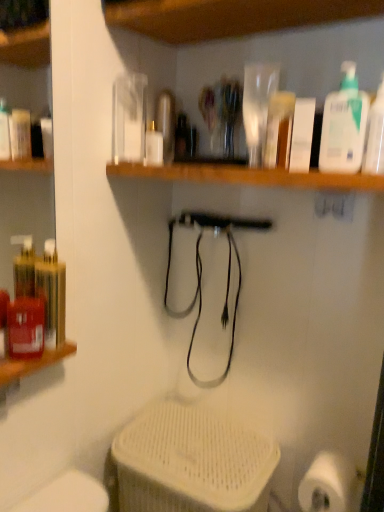
Question: Does translucent plastic bottle at upper right, the first cleaning product from the right, come behind white matte bottle at center?

Choices:
 (A) yes
 (B) no

Answer: (B)

Question: Can you confirm if translucent plastic bottle at upper right, marked as the 2th cleaning product in a left-to-right arrangement, is taller than white matte bottle at center?

Choices:
 (A) no
 (B) yes

Answer: (B)

Question: Considering the relative sizes of translucent plastic bottle at upper right, marked as the 2th cleaning product in a left-to-right arrangement, and white matte bottle at center in the image provided, is translucent plastic bottle at upper right, marked as the 2th cleaning product in a left-to-right arrangement, smaller than white matte bottle at center?

Choices:
 (A) no
 (B) yes

Answer: (B)

Question: Are translucent plastic bottle at upper right, marked as the 2th cleaning product in a left-to-right arrangement, and white matte bottle at center far apart?

Choices:
 (A) yes
 (B) no

Answer: (B)

Question: From the image's perspective, is translucent plastic bottle at upper right, marked as the 2th cleaning product in a left-to-right arrangement, over white matte bottle at center?

Choices:
 (A) yes
 (B) no

Answer: (B)

Question: Is white plastic pump bottle at upper right, arranged as the first cleaning product when viewed from the left, inside or outside of white matte bottle at center?

Choices:
 (A) inside
 (B) outside

Answer: (B)

Question: Is white plastic pump bottle at upper right, arranged as the first cleaning product when viewed from the left, in front of or behind white matte bottle at center in the image?

Choices:
 (A) front
 (B) behind

Answer: (A)

Question: Considering the positions of white plastic pump bottle at upper right, arranged as the first cleaning product when viewed from the left, and white matte bottle at center in the image, is white plastic pump bottle at upper right, arranged as the first cleaning product when viewed from the left, taller or shorter than white matte bottle at center?

Choices:
 (A) tall
 (B) short

Answer: (A)

Question: From a real-world perspective, is white plastic pump bottle at upper right, arranged as the first cleaning product when viewed from the left, positioned above or below white matte bottle at center?

Choices:
 (A) below
 (B) above

Answer: (B)

Question: From the image's perspective, is white plastic pump bottle at upper right, positioned as the 2th cleaning product in right-to-left order, above or below translucent plastic bottle at upper right, marked as the 2th cleaning product in a left-to-right arrangement?

Choices:
 (A) above
 (B) below

Answer: (A)

Question: Considering the positions of white plastic pump bottle at upper right, positioned as the 2th cleaning product in right-to-left order, and translucent plastic bottle at upper right, the first cleaning product from the right, in the image, is white plastic pump bottle at upper right, positioned as the 2th cleaning product in right-to-left order, bigger or smaller than translucent plastic bottle at upper right, the first cleaning product from the right,?

Choices:
 (A) small
 (B) big

Answer: (B)

Question: Is white plastic pump bottle at upper right, positioned as the 2th cleaning product in right-to-left order, to the left or to the right of translucent plastic bottle at upper right, marked as the 2th cleaning product in a left-to-right arrangement, in the image?

Choices:
 (A) left
 (B) right

Answer: (A)

Question: Considering the positions of white plastic pump bottle at upper right, positioned as the 2th cleaning product in right-to-left order, and translucent plastic bottle at upper right, marked as the 2th cleaning product in a left-to-right arrangement, in the image, is white plastic pump bottle at upper right, positioned as the 2th cleaning product in right-to-left order, taller or shorter than translucent plastic bottle at upper right, marked as the 2th cleaning product in a left-to-right arrangement,?

Choices:
 (A) tall
 (B) short

Answer: (A)

Question: Is white matte toilet paper at lower right in front of or behind white matte bottle at center in the image?

Choices:
 (A) front
 (B) behind

Answer: (A)

Question: In the image, is white matte toilet paper at lower right on the left side or the right side of white matte bottle at center?

Choices:
 (A) right
 (B) left

Answer: (A)